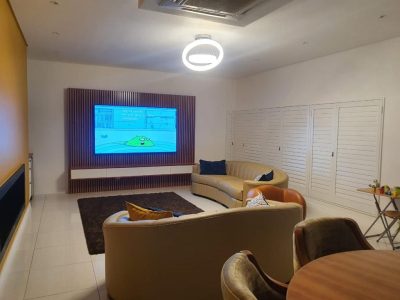
Locate an element on the screen. The image size is (400, 300). chair is located at coordinates (229, 281).